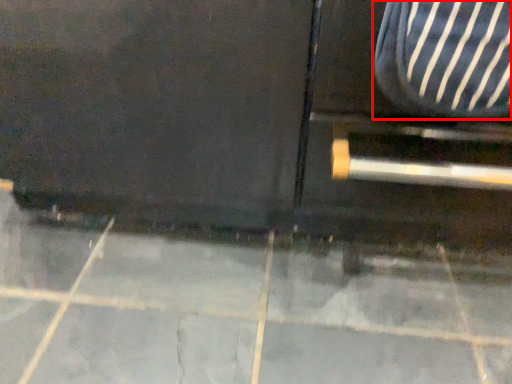
Question: From the image's perspective, what is the correct spatial positioning of armchair (annotated by the red box) in reference to concrete?

Choices:
 (A) below
 (B) above

Answer: (B)